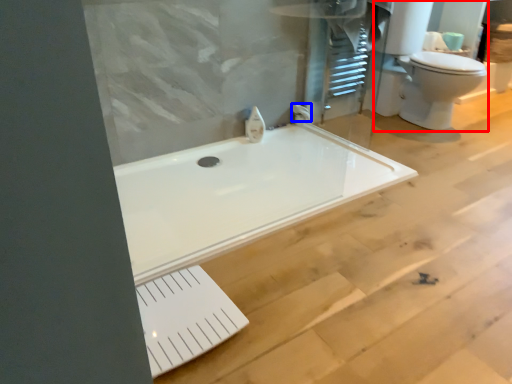
Question: Which of the following is the closest to the observer, sink (highlighted by a red box) or faucet (highlighted by a blue box)?

Choices:
 (A) sink
 (B) faucet

Answer: (A)